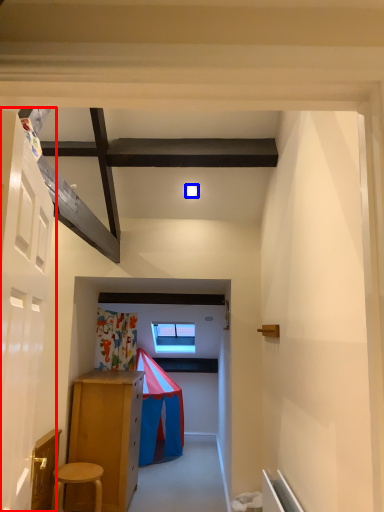
Question: Which point is closer to the camera, door (highlighted by a red box) or light (highlighted by a blue box)?

Choices:
 (A) door
 (B) light

Answer: (A)